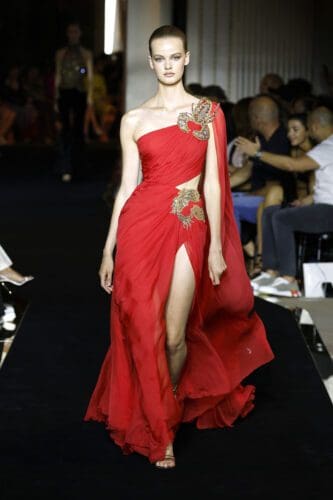
At what (x,y) coordinates should I click in order to perform the action: click on background curtain. Please return your answer as a coordinate pair (x, y). The height and width of the screenshot is (500, 333). Looking at the image, I should click on (276, 19).